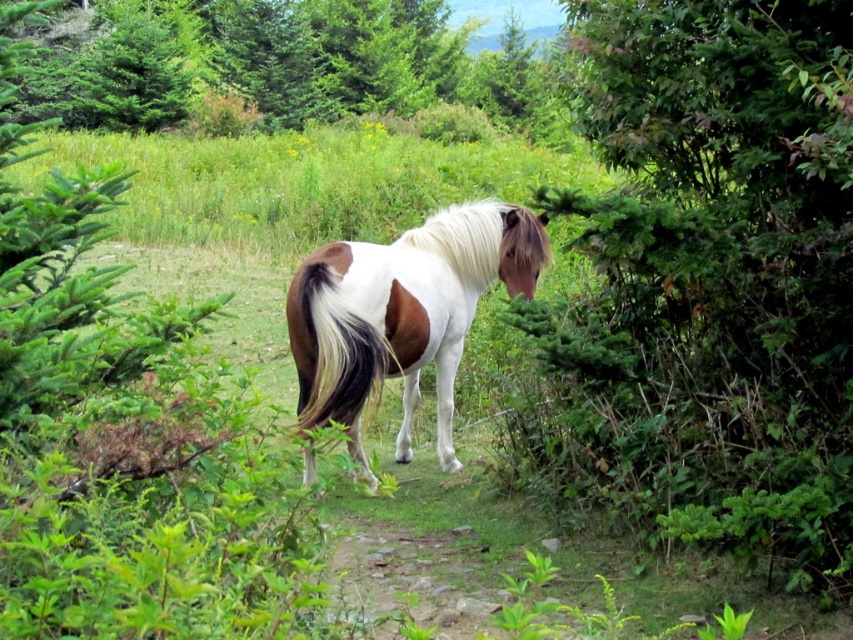
Looking at this image, you are a photographer trying to capture the horse from above. You notice the white silky tail at center and the white silky mane at center. Which one would be visible first as you move your camera downward from the horse?

The white silky mane at center would be visible first as you move the camera downward because the white silky tail at center is located below it.

You are observing a horse in a meadow. You notice the horse has a white silky tail at center and a white silky mane at center. From the horse rider perspective, which of these is on the left side?

The white silky tail at center is to the left of the white silky mane at center, so from the rider perspective sitting on the horse, the white silky tail at center would be on the left side.